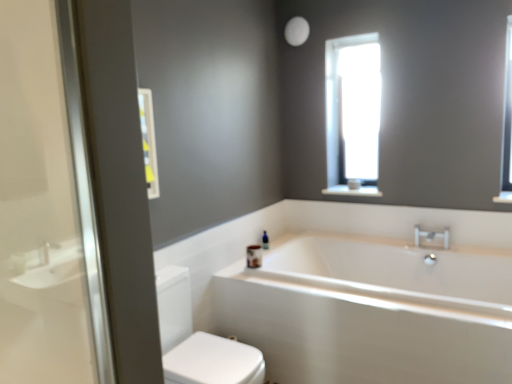
The width and height of the screenshot is (512, 384). Find the location of `vacant area that is in front of silver metallic faucet at upper right`. vacant area that is in front of silver metallic faucet at upper right is located at coordinates (443, 255).